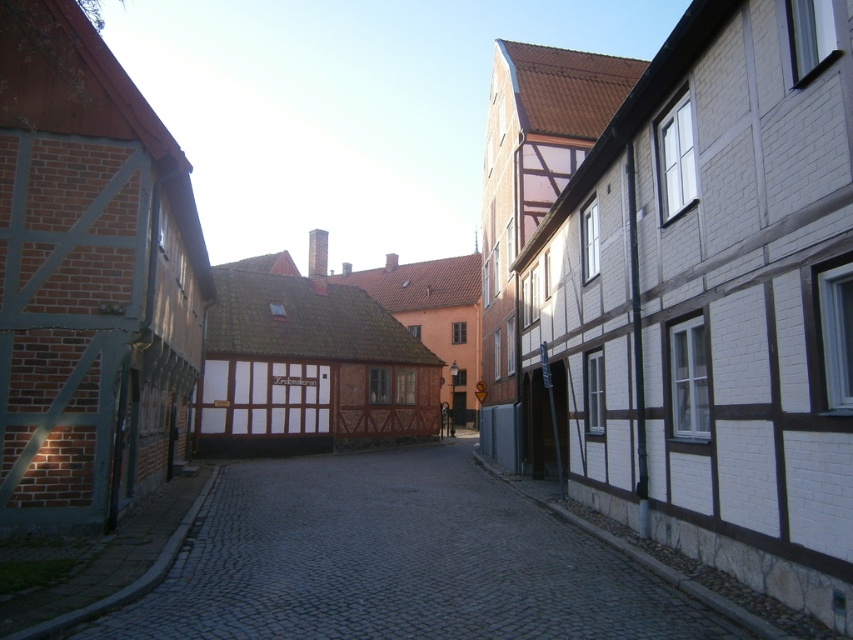
Question: Can you confirm if white wooden building at right is wider than gray cobblestone alley at center?

Choices:
 (A) yes
 (B) no

Answer: (B)

Question: Is white wooden building at right positioned before gray cobblestone alley at center?

Choices:
 (A) no
 (B) yes

Answer: (B)

Question: Which point is farther to the camera?

Choices:
 (A) gray cobblestone alley at center
 (B) white wooden building at right

Answer: (A)

Question: Where is white wooden building at right located in relation to gray cobblestone alley at center in the image?

Choices:
 (A) below
 (B) above

Answer: (B)

Question: Which of the following is the farthest from the observer?

Choices:
 (A) (309, 497)
 (B) (849, 232)

Answer: (A)

Question: Among these objects, which one is nearest to the camera?

Choices:
 (A) white wooden building at right
 (B) gray cobblestone alley at center

Answer: (A)